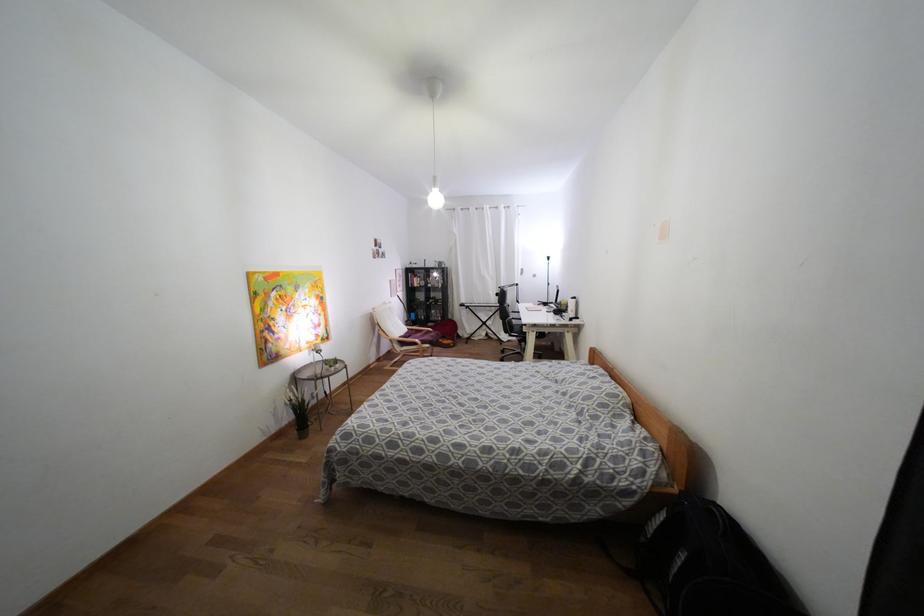
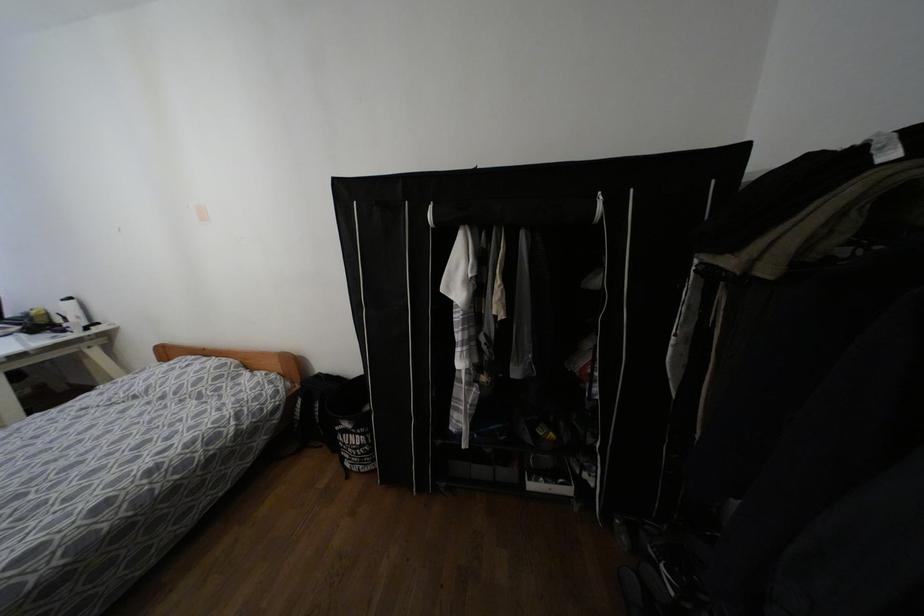
The point at (574,297) is marked in the first image. Where is the corresponding point in the second image?

(68, 299)